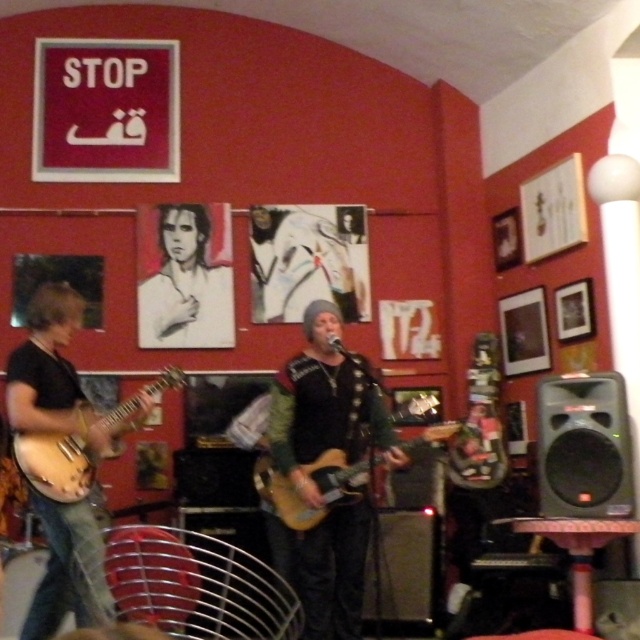
Is point (378, 384) closer to viewer compared to point (196, 337)?

Yes.

Does matte black guitar at center appear on the left side of black and white portrait at upper center?

Incorrect, matte black guitar at center is not on the left side of black and white portrait at upper center.

Between point (392, 460) and point (163, 342), which one is positioned behind?

The point (163, 342) is behind.

Where is `matte black guitar at center`? This screenshot has height=640, width=640. matte black guitar at center is located at coordinates (326, 404).

Can you confirm if matte black guitar at left is positioned above black and white portrait at upper center?

Incorrect, matte black guitar at left is not positioned above black and white portrait at upper center.

Does matte black guitar at left have a smaller size compared to black and white portrait at upper center?

No.

Who is more forward, (72,413) or (168,205)?

Positioned in front is point (72,413).

Identify the location of matte black guitar at left. The height and width of the screenshot is (640, 640). (52, 372).

Which is below, black and white portrait at upper center or matte brown guitar at left?

Positioned lower is matte brown guitar at left.

Does point (189, 346) come behind point (109, 422)?

Yes, it is behind point (109, 422).

Who is more forward, (172, 323) or (68, 435)?

Point (68, 435) is more forward.

Find the location of a particular element. black and white portrait at upper center is located at coordinates (186, 276).